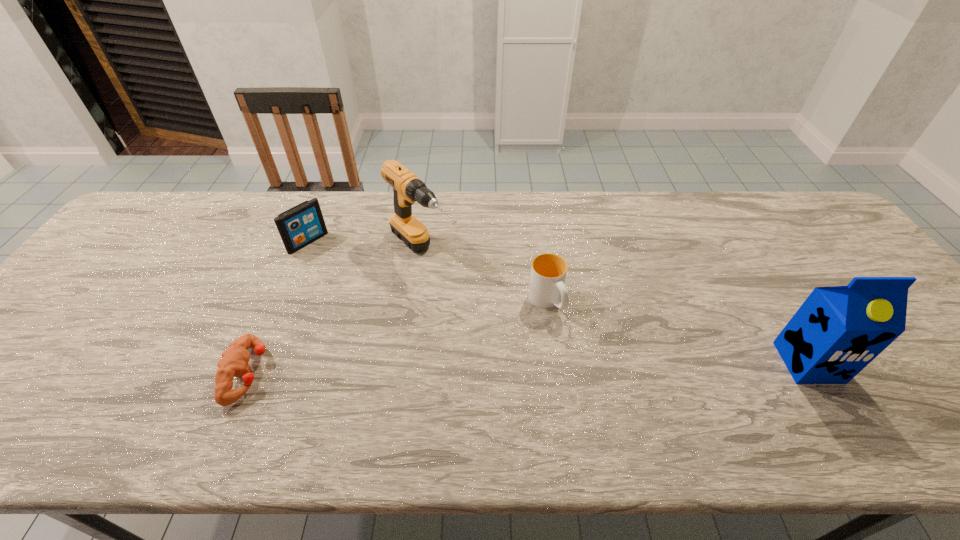
Where is `empty location between the iPod and the third nearest object`? The height and width of the screenshot is (540, 960). empty location between the iPod and the third nearest object is located at coordinates (427, 272).

Locate an element on the screen. The height and width of the screenshot is (540, 960). free area in between the iPod and the second object from right to left is located at coordinates (427, 272).

Find the location of a particular element. The image size is (960, 540). empty space that is in between the fourth object from left to right and the drill is located at coordinates (485, 276).

The width and height of the screenshot is (960, 540). I want to click on vacant area that lies between the iPod and the puncher, so click(x=277, y=308).

Select which object is the third closest to the third object from right to left. Please provide its 2D coordinates. Your answer should be formatted as a tuple, i.e. [(x, y)], where the tuple contains the x and y coordinates of a point satisfying the conditions above.

[(234, 360)]

The image size is (960, 540). What are the coordinates of `object that stands as the closest to the iPod` in the screenshot? It's located at (407, 188).

You are a GUI agent. You are given a task and a screenshot of the screen. Output one action in this format:
    pyautogui.click(x=<x>, y=<y>)
    Task: Click on the vacant region that satisfies the following two spatial constraints: 1. on the front side of the drill; 2. on the left side of the iPod
    This screenshot has height=540, width=960.
    Given the screenshot: What is the action you would take?
    pyautogui.click(x=304, y=252)